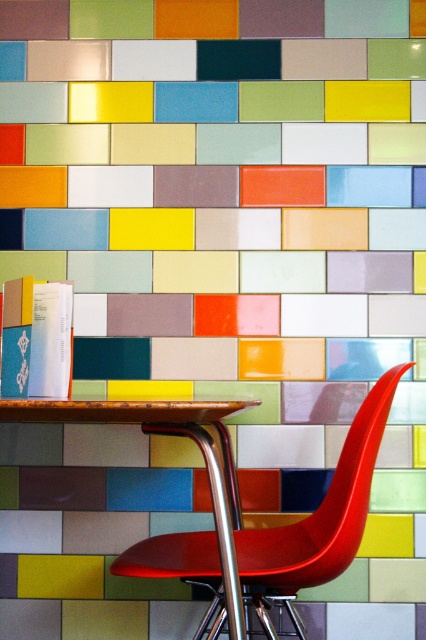
Is shiny red plastic chair at center thinner than wooden table at center?

In fact, shiny red plastic chair at center might be wider than wooden table at center.

Describe the element at coordinates (317, 520) in the screenshot. I see `shiny red plastic chair at center` at that location.

Between point (302, 634) and point (183, 420), which one is positioned in front?

Positioned in front is point (183, 420).

This screenshot has height=640, width=426. Find the location of `shiny red plastic chair at center`. shiny red plastic chair at center is located at coordinates (317, 520).